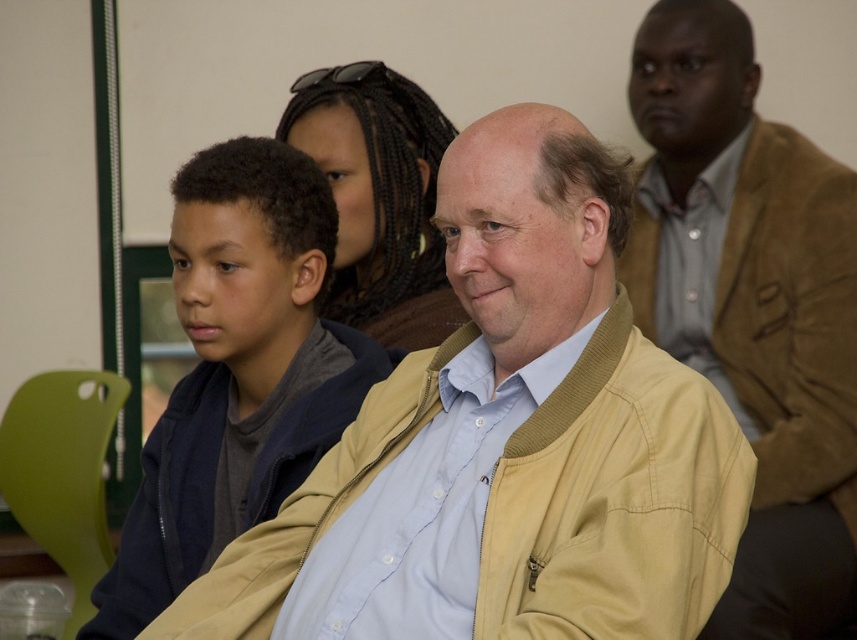
Question: Which of the following is the closest to the observer?

Choices:
 (A) dark blue jacket at left
 (B) brown braided hair at center
 (C) light beige jacket at center

Answer: (C)

Question: Considering the real-world distances, which object is farthest from the light beige jacket at center?

Choices:
 (A) dark blue jacket at left
 (B) brown braided hair at center

Answer: (B)

Question: Considering the relative positions of light beige jacket at center and brown braided hair at center in the image provided, where is light beige jacket at center located with respect to brown braided hair at center?

Choices:
 (A) right
 (B) left

Answer: (A)

Question: Which object is the farthest from the dark blue jacket at left?

Choices:
 (A) light beige jacket at center
 (B) brown braided hair at center

Answer: (B)

Question: Does brown leather jacket at upper right have a larger size compared to brown braided hair at center?

Choices:
 (A) no
 (B) yes

Answer: (B)

Question: In this image, where is light beige jacket at center located relative to brown leather jacket at upper right?

Choices:
 (A) left
 (B) right

Answer: (A)